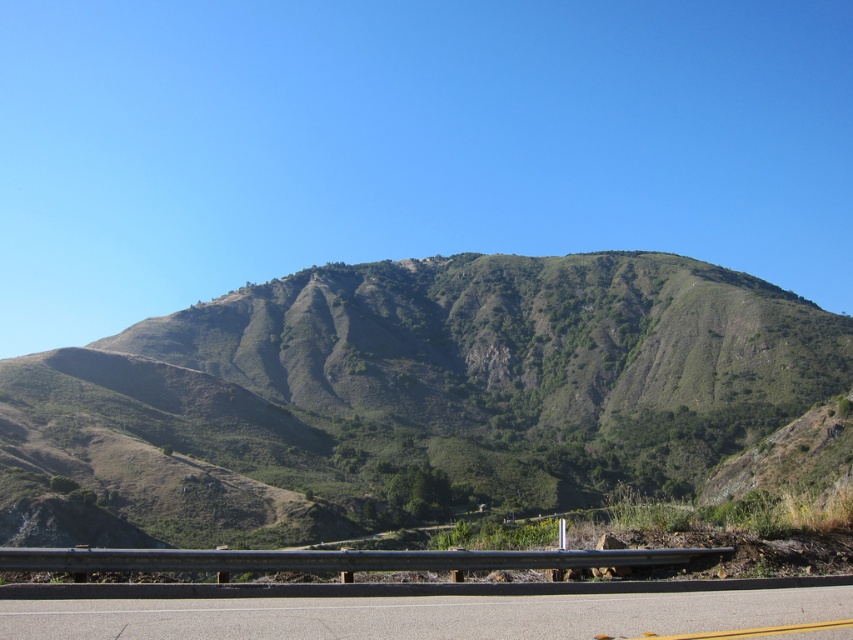
Question: Is green grassy mountain at center above asphalt road at center?

Choices:
 (A) no
 (B) yes

Answer: (A)

Question: Which of the following is the farthest from the observer?

Choices:
 (A) green grassy mountain at center
 (B) asphalt road at center

Answer: (A)

Question: Which point appears farthest from the camera in this image?

Choices:
 (A) (769, 340)
 (B) (345, 588)

Answer: (A)

Question: Does green grassy mountain at center appear on the right side of asphalt road at center?

Choices:
 (A) no
 (B) yes

Answer: (A)

Question: Does green grassy mountain at center appear on the right side of asphalt road at center?

Choices:
 (A) yes
 (B) no

Answer: (B)

Question: Which object appears farthest from the camera in this image?

Choices:
 (A) asphalt road at center
 (B) green grassy mountain at center

Answer: (B)